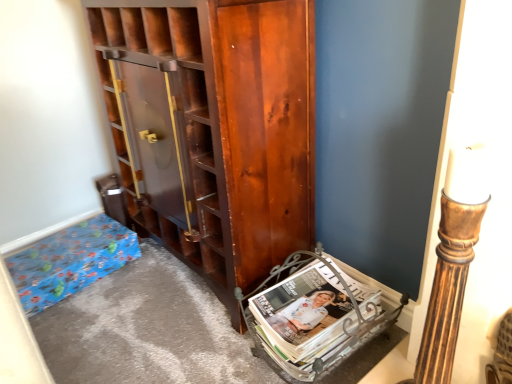
Where is `vacant region to the left of matte metallic magazine rack at lower right`? vacant region to the left of matte metallic magazine rack at lower right is located at coordinates (219, 345).